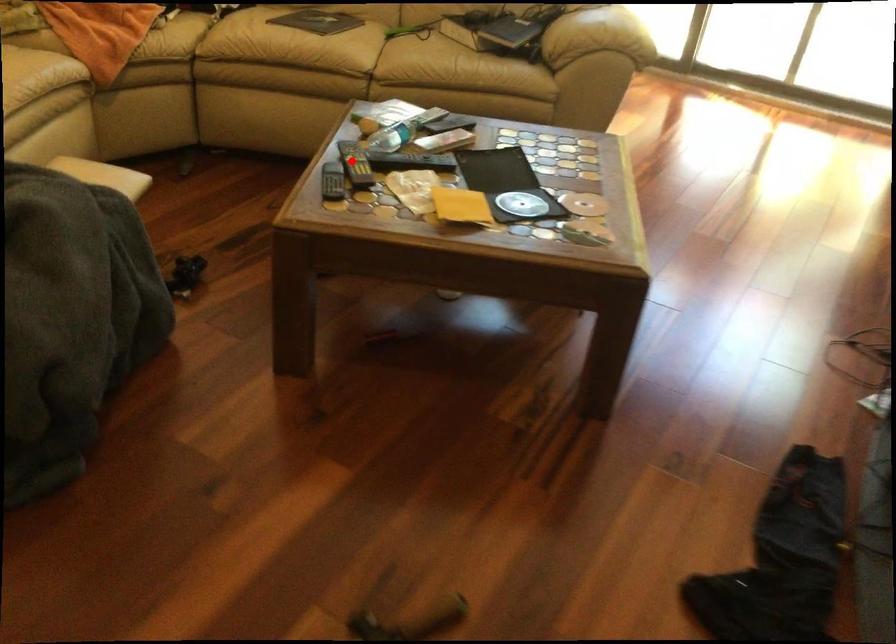
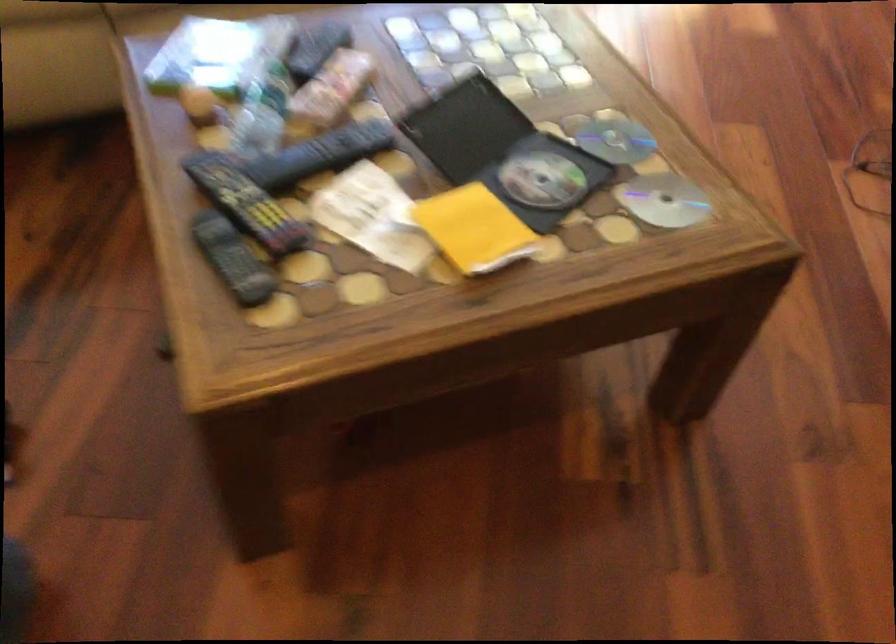
Find the pixel in the second image that matches the highlighted location in the first image.

(245, 202)